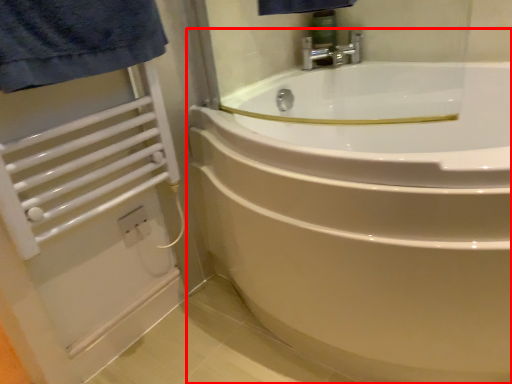
Question: Observing the image, what is the correct spatial positioning of bathtub (annotated by the red box) in reference to balustrade?

Choices:
 (A) right
 (B) left

Answer: (A)